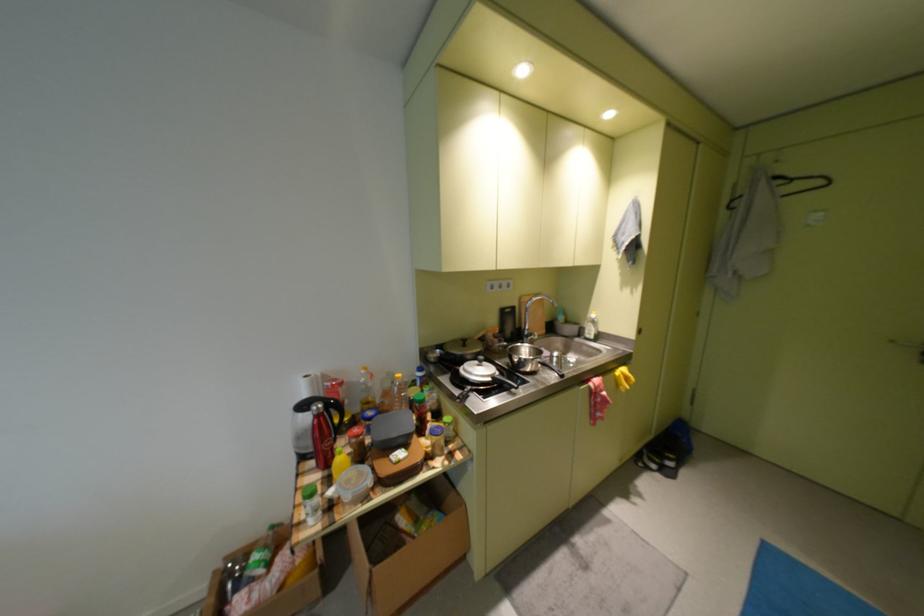
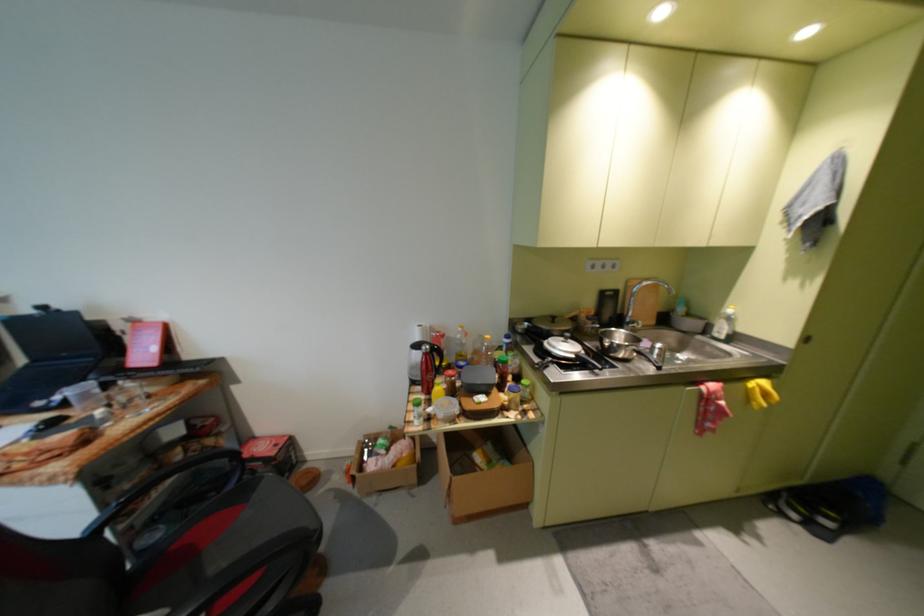
In the second image, find the point that corresponds to [231,565] in the first image.

(372, 440)